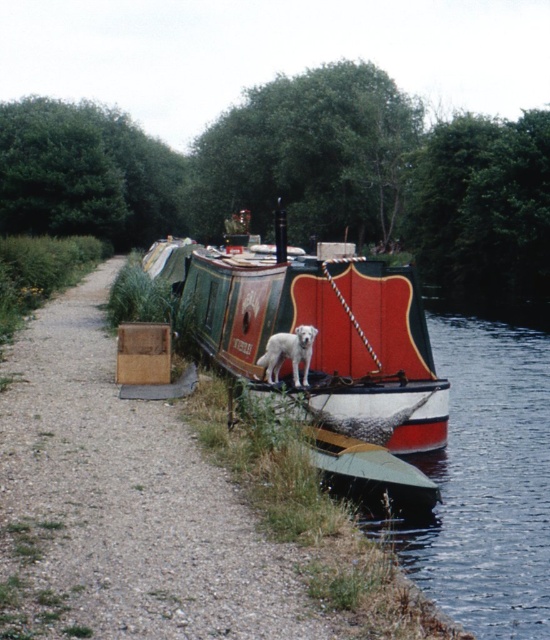
You are a delivery person needing to place a large package on the polished wood barge at center. The package is as big as the white fur dog at center. Can you fit it on the barge?

The polished wood barge at center is bigger than the white fur dog at center, so yes, the package can fit on the barge since it is smaller than the barge.

You are a delivery person who needs to carry a large package from the path to the polished wood barge at center. The path is narrow and lined with stones. Considering the size of the white fur dog at center, can you safely pass by it to reach the barge?

The polished wood barge at center might be wider than the white fur dog at center, so there could be enough space to safely navigate around the dog while carrying the package to the barge.